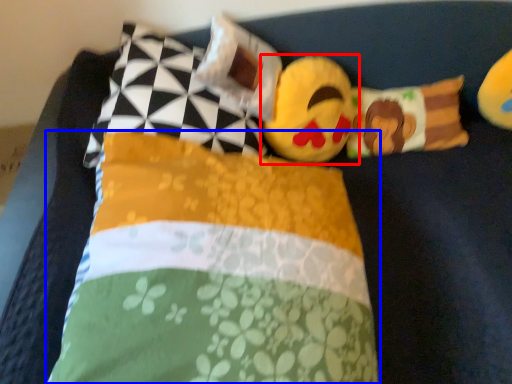
Question: Which object is closer to the camera taking this photo, toy (highlighted by a red box) or pillow (highlighted by a blue box)?

Choices:
 (A) toy
 (B) pillow

Answer: (B)